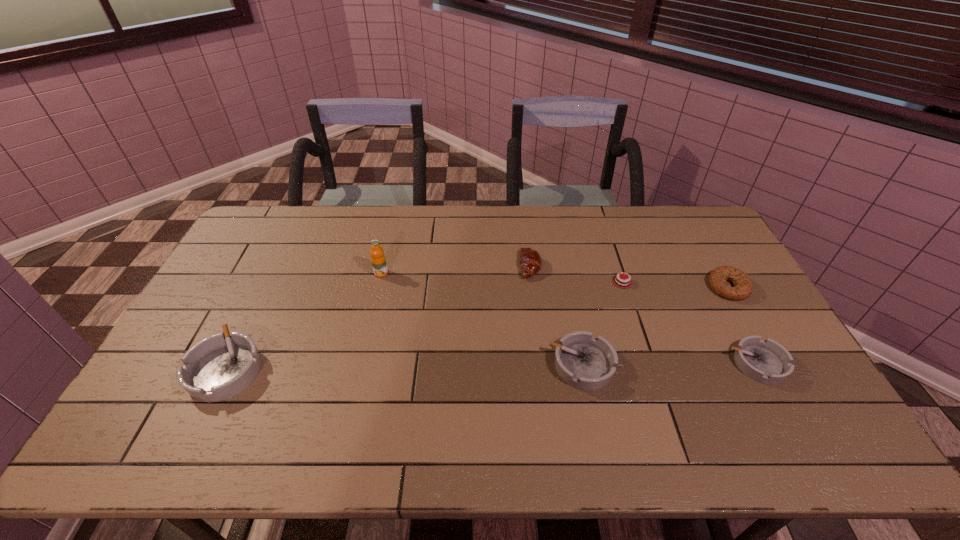
Where is `free space for an extra ashtray to achieve even spacing`? free space for an extra ashtray to achieve even spacing is located at coordinates (404, 367).